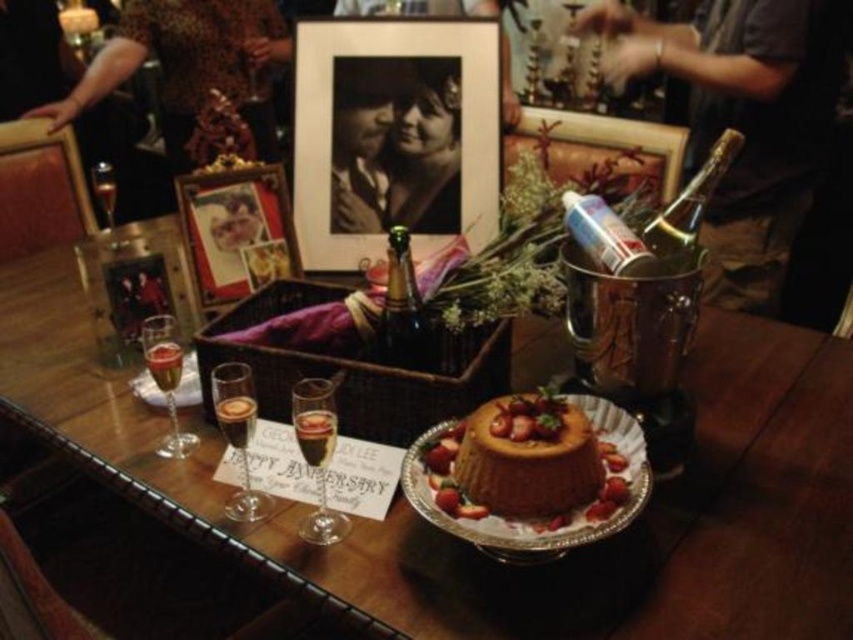
Who is more forward, (427, 556) or (376, 138)?

Point (427, 556) is in front.

This screenshot has width=853, height=640. What do you see at coordinates (473, 550) in the screenshot?
I see `wooden table at center` at bounding box center [473, 550].

At what (x,y) coordinates should I click in order to perform the action: click on wooden table at center. Please return your answer as a coordinate pair (x, y). The height and width of the screenshot is (640, 853). Looking at the image, I should click on (473, 550).

Which is more to the right, black matte photo frame at center or matte black photo frame at upper center?

Positioned to the right is black matte photo frame at center.

This screenshot has height=640, width=853. Describe the element at coordinates (393, 134) in the screenshot. I see `black matte photo frame at center` at that location.

Image resolution: width=853 pixels, height=640 pixels. What do you see at coordinates (393, 134) in the screenshot?
I see `black matte photo frame at center` at bounding box center [393, 134].

The width and height of the screenshot is (853, 640). What are the coordinates of `black matte photo frame at center` in the screenshot? It's located at (393, 134).

Is metallic silver can at upper right smaller than translucent glass champagne flute at center?

Incorrect, metallic silver can at upper right is not smaller in size than translucent glass champagne flute at center.

Can you confirm if metallic silver can at upper right is shorter than translucent glass champagne flute at center?

No, metallic silver can at upper right is not shorter than translucent glass champagne flute at center.

Between point (614, 228) and point (300, 452), which one is positioned behind?

The point (614, 228) is behind.

Locate an element on the screen. The image size is (853, 640). metallic silver can at upper right is located at coordinates (604, 236).